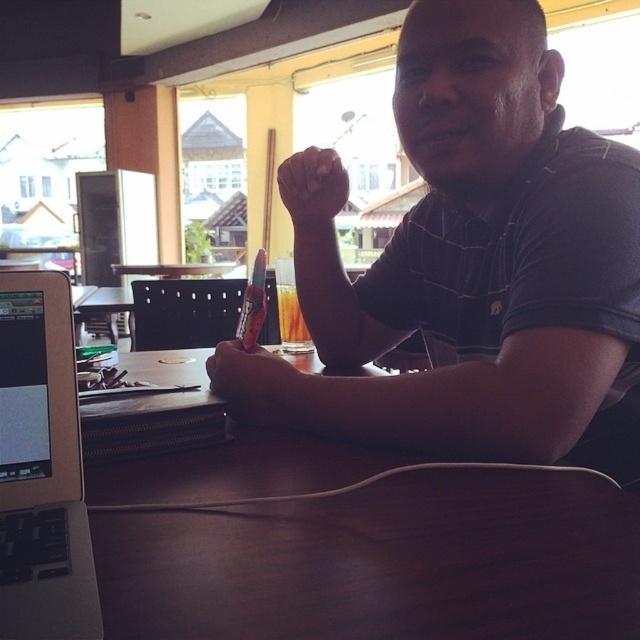
Question: Which point is farther from the camera taking this photo?

Choices:
 (A) (410, 211)
 (B) (10, 326)
 (C) (208, 365)

Answer: (A)

Question: Which point is farther to the camera?

Choices:
 (A) [300, 388]
 (B) [77, 436]
 (C) [472, 625]

Answer: (A)

Question: Considering the real-world distances, which object is farthest from the matte black shirt at center?

Choices:
 (A) brown leather pen at center
 (B) dark skin hand at center

Answer: (B)

Question: Does matte black shirt at center appear under dark skin hand at center?

Choices:
 (A) yes
 (B) no

Answer: (A)

Question: Does brown wood table at center have a smaller size compared to brown leather pen at center?

Choices:
 (A) no
 (B) yes

Answer: (A)

Question: Is brown leather pen at center in front of dark skin hand at center?

Choices:
 (A) yes
 (B) no

Answer: (A)